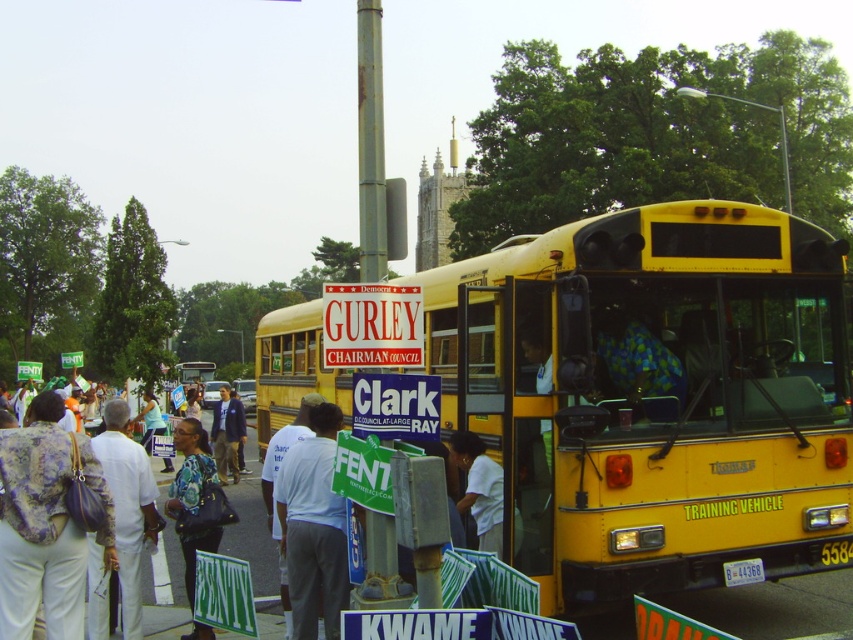
Who is positioned more to the right, patterned fabric coat at lower left or white plastic sign at center?

white plastic sign at center

What do you see at coordinates (45, 525) in the screenshot?
I see `patterned fabric coat at lower left` at bounding box center [45, 525].

I want to click on patterned fabric coat at lower left, so click(x=45, y=525).

Is point (636, 316) positioned behind point (238, 426)?

No, (636, 316) is closer to viewer.

Who is positioned more to the right, yellow matte bus at center or dark blue fabric jacket at center?

yellow matte bus at center

Between point (674, 576) and point (222, 454), which one is positioned in front?

Point (674, 576) is more forward.

At what (x,y) coordinates should I click in order to perform the action: click on yellow matte bus at center. Please return your answer as a coordinate pair (x, y). The width and height of the screenshot is (853, 640). Looking at the image, I should click on (656, 397).

Does blue-green checkered shirt at center come in front of dark blue fabric jacket at center?

That is True.

Does blue-green checkered shirt at center have a smaller size compared to dark blue fabric jacket at center?

Correct, blue-green checkered shirt at center occupies less space than dark blue fabric jacket at center.

In order to click on blue-green checkered shirt at center in this screenshot , I will do `click(634, 360)`.